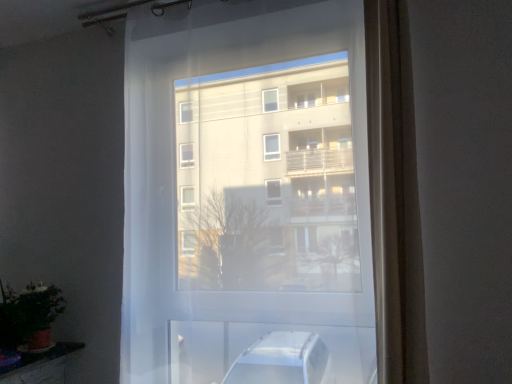
Question: Considering the relative sizes of satin beige curtain at right and transparent fabric at center in the image provided, is satin beige curtain at right thinner than transparent fabric at center?

Choices:
 (A) no
 (B) yes

Answer: (A)

Question: Is satin beige curtain at right in front of transparent fabric at center?

Choices:
 (A) yes
 (B) no

Answer: (A)

Question: Considering the relative positions of satin beige curtain at right and transparent fabric at center in the image provided, is satin beige curtain at right to the left of transparent fabric at center from the viewer's perspective?

Choices:
 (A) yes
 (B) no

Answer: (B)

Question: Is satin beige curtain at right completely or partially outside of transparent fabric at center?

Choices:
 (A) no
 (B) yes

Answer: (B)

Question: Is satin beige curtain at right directly adjacent to transparent fabric at center?

Choices:
 (A) yes
 (B) no

Answer: (B)

Question: Considering the relative sizes of satin beige curtain at right and transparent fabric at center in the image provided, is satin beige curtain at right bigger than transparent fabric at center?

Choices:
 (A) yes
 (B) no

Answer: (B)

Question: Is satin beige curtain at right turned away from green matte plant at lower left?

Choices:
 (A) no
 (B) yes

Answer: (A)

Question: Is satin beige curtain at right not within green matte plant at lower left?

Choices:
 (A) no
 (B) yes

Answer: (B)

Question: Can you confirm if satin beige curtain at right is shorter than green matte plant at lower left?

Choices:
 (A) no
 (B) yes

Answer: (A)

Question: From a real-world perspective, is satin beige curtain at right under green matte plant at lower left?

Choices:
 (A) yes
 (B) no

Answer: (B)

Question: From the image's perspective, is satin beige curtain at right over green matte plant at lower left?

Choices:
 (A) no
 (B) yes

Answer: (B)

Question: Is satin beige curtain at right to the left of green matte plant at lower left from the viewer's perspective?

Choices:
 (A) yes
 (B) no

Answer: (B)

Question: Considering the relative positions of transparent fabric at center and satin beige curtain at right in the image provided, is transparent fabric at center to the right of satin beige curtain at right from the viewer's perspective?

Choices:
 (A) yes
 (B) no

Answer: (B)